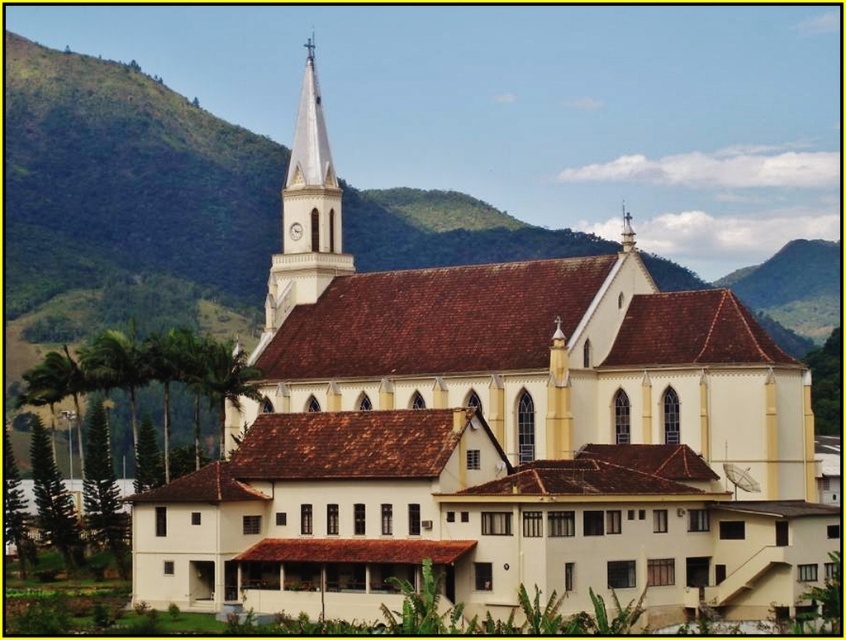
Question: Is white glossy steeple at upper center below smooth white spire at upper center?

Choices:
 (A) no
 (B) yes

Answer: (A)

Question: Can you confirm if white glossy steeple at upper center is thinner than smooth white spire at upper center?

Choices:
 (A) no
 (B) yes

Answer: (B)

Question: Does white glossy steeple at upper center come in front of smooth white spire at upper center?

Choices:
 (A) yes
 (B) no

Answer: (B)

Question: Among these objects, which one is nearest to the camera?

Choices:
 (A) white glossy steeple at upper center
 (B) smooth white spire at upper center

Answer: (B)